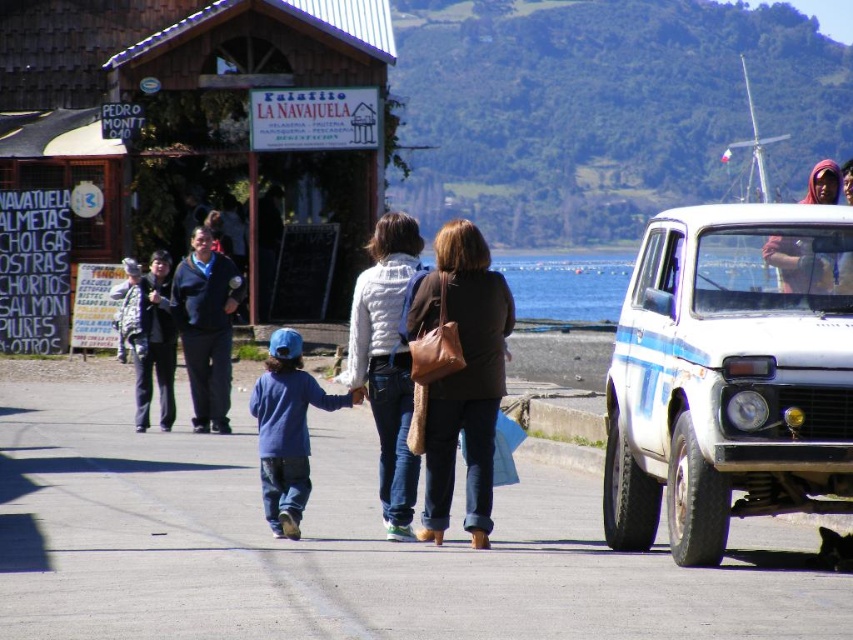
Describe the element at coordinates (387, 362) in the screenshot. I see `white knit sweater at center` at that location.

Is the position of white knit sweater at center more distant than that of matte pink scarf at upper right?

Yes, it is.

Find the location of a particular element. The image size is (853, 640). white knit sweater at center is located at coordinates (387, 362).

Is white matte car at right bigger than white knit sweater at center?

Incorrect, white matte car at right is not larger than white knit sweater at center.

Can you confirm if white matte car at right is shorter than white knit sweater at center?

Correct, white matte car at right is not as tall as white knit sweater at center.

What do you see at coordinates (730, 374) in the screenshot? I see `white matte car at right` at bounding box center [730, 374].

Image resolution: width=853 pixels, height=640 pixels. What are the coordinates of `white matte car at right` in the screenshot? It's located at (730, 374).

Does white knit sweater at center have a smaller size compared to blue cotton shirt at center?

No, white knit sweater at center is not smaller than blue cotton shirt at center.

Which is more to the left, white knit sweater at center or blue cotton shirt at center?

blue cotton shirt at center is more to the left.

Who is more forward, (370, 272) or (292, 346)?

Positioned in front is point (292, 346).

Identify the location of white knit sweater at center. (387, 362).